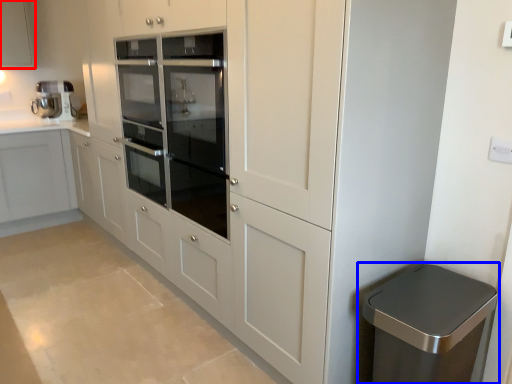
Question: Which point is further to the camera, cabinetry (highlighted by a red box) or waste container (highlighted by a blue box)?

Choices:
 (A) cabinetry
 (B) waste container

Answer: (A)